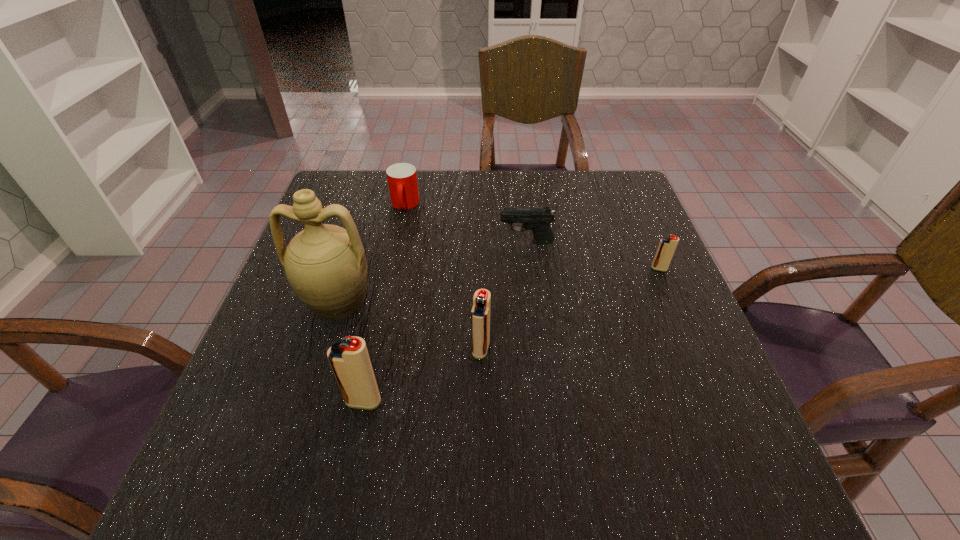
Please mark a free spot for a new igniter to balance the arrangement. Please provide its 2D coordinates. Your answer should be formatted as a tuple, i.e. [(x, y)], where the tuple contains the x and y coordinates of a point satisfying the conditions above.

[(578, 305)]